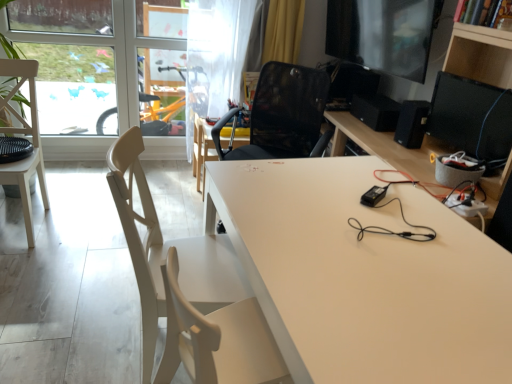
Locate an element on the screen. The height and width of the screenshot is (384, 512). vacant space positioned to the left of white wood chair at left, the second chair in the left-to-right sequence is located at coordinates (84, 326).